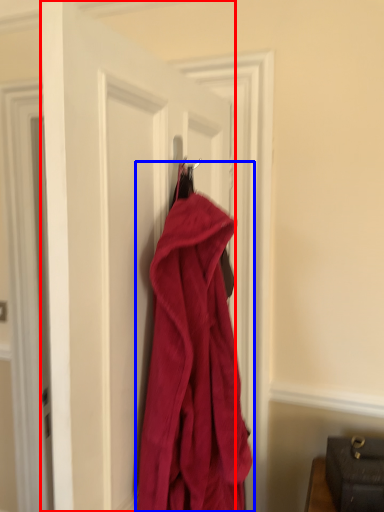
Question: Which object is closer to the camera taking this photo, door (highlighted by a red box) or towel (highlighted by a blue box)?

Choices:
 (A) door
 (B) towel

Answer: (A)